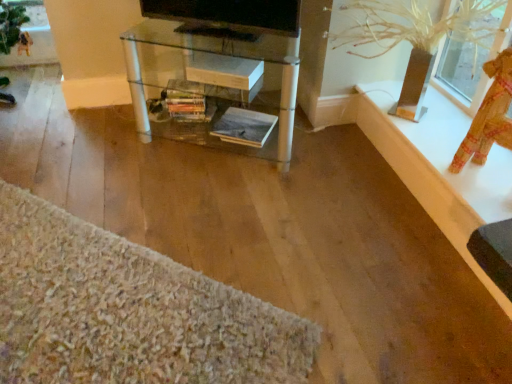
Describe the element at coordinates (489, 116) in the screenshot. This screenshot has height=384, width=512. I see `textured fabric doll at upper right` at that location.

The width and height of the screenshot is (512, 384). What do you see at coordinates (230, 14) in the screenshot?
I see `black glossy tv at upper center` at bounding box center [230, 14].

This screenshot has height=384, width=512. Find the location of `clear glass table at center`. clear glass table at center is located at coordinates (216, 53).

Is textured fabric doll at upper right closer to camera compared to clear glass table at center?

Answer: That is True.

Which object is positioned more to the right, textured fabric doll at upper right or clear glass table at center?

textured fabric doll at upper right is more to the right.

Is textured fabric doll at upper right bigger or smaller than clear glass table at center?

Clearly, textured fabric doll at upper right is smaller in size than clear glass table at center.

From a real-world perspective, is textured fabric doll at upper right under clear glass table at center?

No, from a real-world perspective, textured fabric doll at upper right is not below clear glass table at center.

Between clear glass table at center and clear plastic vase at upper right, which one has smaller width?

With smaller width is clear glass table at center.

Does point (278, 156) appear closer or farther from the camera than point (408, 90)?

Point (278, 156) is farther from the camera than point (408, 90).

Is clear glass table at center directly adjacent to clear plastic vase at upper right?

No, clear glass table at center is not touching clear plastic vase at upper right.

Is textured beige rug at lower left bigger than clear plastic vase at upper right?

No.

Is clear plastic vase at upper right surrounded by textured beige rug at lower left?

Definitely not — clear plastic vase at upper right is not inside textured beige rug at lower left.

From a real-world perspective, which is physically above, textured beige rug at lower left or clear plastic vase at upper right?

From a 3D spatial view, clear plastic vase at upper right is above.

Which object is closer to the camera, textured beige rug at lower left or clear plastic vase at upper right?

textured beige rug at lower left is in front.

Identify the location of doll below the clear glass table at center (from the image's perspective). (489, 116).

From the image's perspective, between clear glass table at center and textured fabric doll at upper right, which one is located above?

clear glass table at center.

Which object is more forward, clear glass table at center or textured fabric doll at upper right?

textured fabric doll at upper right is closer to the camera.

Locate an element on the screen. This screenshot has width=512, height=384. plain lying on the left of textured fabric doll at upper right is located at coordinates (128, 311).

Between textured beige rug at lower left and textured fabric doll at upper right, which one appears on the right side from the viewer's perspective?

From the viewer's perspective, textured fabric doll at upper right appears more on the right side.

Is textured fabric doll at upper right located within textured beige rug at lower left?

No, textured fabric doll at upper right is not a part of textured beige rug at lower left.

Is textured beige rug at lower left turned away from textured fabric doll at upper right?

No, textured fabric doll at upper right is not at the back of textured beige rug at lower left.

Is the depth of textured beige rug at lower left less than that of white glossy ledge at upper right?

Yes, it is in front of white glossy ledge at upper right.

Is textured beige rug at lower left completely or partially outside of white glossy ledge at upper right?

Yes, textured beige rug at lower left is outside of white glossy ledge at upper right.

Looking at this image, how many degrees apart are the facing directions of textured beige rug at lower left and white glossy ledge at upper right?

139 degrees.

Based on the photo, between textured beige rug at lower left and white glossy ledge at upper right, which one has larger size?

textured beige rug at lower left is bigger.

Considering the sizes of objects black glossy tv at upper center and textured beige rug at lower left in the image provided, who is shorter, black glossy tv at upper center or textured beige rug at lower left?

Standing shorter between the two is textured beige rug at lower left.

From a real-world perspective, which object rests below the other?

textured beige rug at lower left, from a real-world perspective.

Can we say black glossy tv at upper center lies outside textured beige rug at lower left?

Yes, black glossy tv at upper center is outside of textured beige rug at lower left.

In the scene shown: Which object is wider, black glossy tv at upper center or textured beige rug at lower left?

With larger width is textured beige rug at lower left.

Identify the location of doll in front of the clear glass table at center. (489, 116).

You are a GUI agent. You are given a task and a screenshot of the screen. Output one action in this format:
    pyautogui.click(x=<x>, y=<y>)
    Task: Click on the table behind the clear plastic vase at upper right
    
    Given the screenshot: What is the action you would take?
    pyautogui.click(x=216, y=53)

When comparing their distances from textured beige rug at lower left, does textured fabric doll at upper right or clear glass table at center seem closer?

clear glass table at center.

When comparing their distances from textured beige rug at lower left, does clear plastic vase at upper right or black glossy tv at upper center seem further?

The object further to textured beige rug at lower left is clear plastic vase at upper right.

Estimate the real-world distances between objects in this image. Which object is further from clear glass table at center, white glossy ledge at upper right or black glossy tv at upper center?

Among the two, white glossy ledge at upper right is located further to clear glass table at center.

Which object lies further to the anchor point black glossy tv at upper center, clear glass table at center or white glossy ledge at upper right?

Based on the image, white glossy ledge at upper right appears to be further to black glossy tv at upper center.

Based on their spatial positions, is clear plastic vase at upper right or white glossy ledge at upper right further from clear glass table at center?

white glossy ledge at upper right is positioned further to the anchor clear glass table at center.

Looking at the image, which one is located further to white glossy ledge at upper right, black glossy tv at upper center or textured beige rug at lower left?

Among the two, textured beige rug at lower left is located further to white glossy ledge at upper right.

Considering their positions, is black glossy tv at upper center positioned further to clear plastic vase at upper right than textured beige rug at lower left?

textured beige rug at lower left.

Considering their positions, is black glossy tv at upper center positioned closer to clear glass table at center than textured fabric doll at upper right?

The object closer to clear glass table at center is black glossy tv at upper center.

This screenshot has width=512, height=384. What are the coordinates of `plant situated between clear glass table at center and white glossy ledge at upper right from left to right` in the screenshot? It's located at (413, 37).

Locate an element on the screen. The height and width of the screenshot is (384, 512). plant between textured beige rug at lower left and textured fabric doll at upper right is located at coordinates (413, 37).

Find the location of a particular element. This screenshot has height=384, width=512. plant situated between black glossy tv at upper center and white glossy ledge at upper right from left to right is located at coordinates (413, 37).

The image size is (512, 384). Find the location of `ledge between textured beige rug at lower left and textured fabric doll at upper right in the horizontal direction`. ledge between textured beige rug at lower left and textured fabric doll at upper right in the horizontal direction is located at coordinates (439, 167).